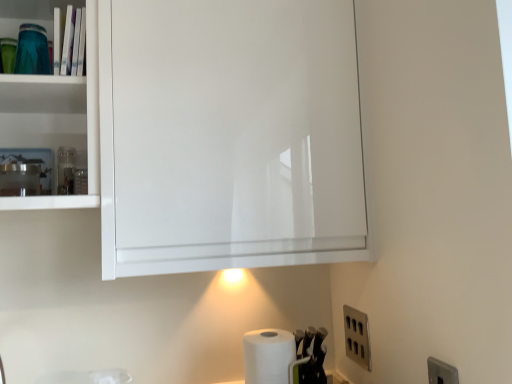
Question: Could you tell me if satin nickel outlet at lower right is turned towards white matte paper towel at lower center?

Choices:
 (A) yes
 (B) no

Answer: (A)

Question: Is satin nickel outlet at lower right at the right side of white matte paper towel at lower center?

Choices:
 (A) no
 (B) yes

Answer: (B)

Question: Is the position of satin nickel outlet at lower right less distant than that of white matte paper towel at lower center?

Choices:
 (A) no
 (B) yes

Answer: (A)

Question: Is satin nickel outlet at lower right not within white matte paper towel at lower center?

Choices:
 (A) yes
 (B) no

Answer: (A)

Question: Would you say white matte paper towel at lower center is part of satin nickel outlet at lower right's contents?

Choices:
 (A) yes
 (B) no

Answer: (B)

Question: Is satin nickel outlet at lower right thinner than white matte paper towel at lower center?

Choices:
 (A) yes
 (B) no

Answer: (A)

Question: Can you confirm if white matte paper towel at lower center is wider than satin nickel outlet at lower right?

Choices:
 (A) no
 (B) yes

Answer: (B)

Question: From the image's perspective, does white matte paper towel at lower center appear lower than satin nickel outlet at lower right?

Choices:
 (A) yes
 (B) no

Answer: (A)

Question: Is white matte paper towel at lower center completely or partially outside of satin nickel outlet at lower right?

Choices:
 (A) no
 (B) yes

Answer: (B)

Question: From a real-world perspective, is white matte paper towel at lower center on satin nickel outlet at lower right?

Choices:
 (A) yes
 (B) no

Answer: (B)

Question: Is white matte paper towel at lower center positioned far away from satin nickel outlet at lower right?

Choices:
 (A) no
 (B) yes

Answer: (A)

Question: Is white matte paper towel at lower center oriented away from satin nickel outlet at lower right?

Choices:
 (A) yes
 (B) no

Answer: (B)

Question: Considering the positions of satin nickel outlet at lower right and white matte paper towel at lower center in the image, is satin nickel outlet at lower right wider or thinner than white matte paper towel at lower center?

Choices:
 (A) wide
 (B) thin

Answer: (B)